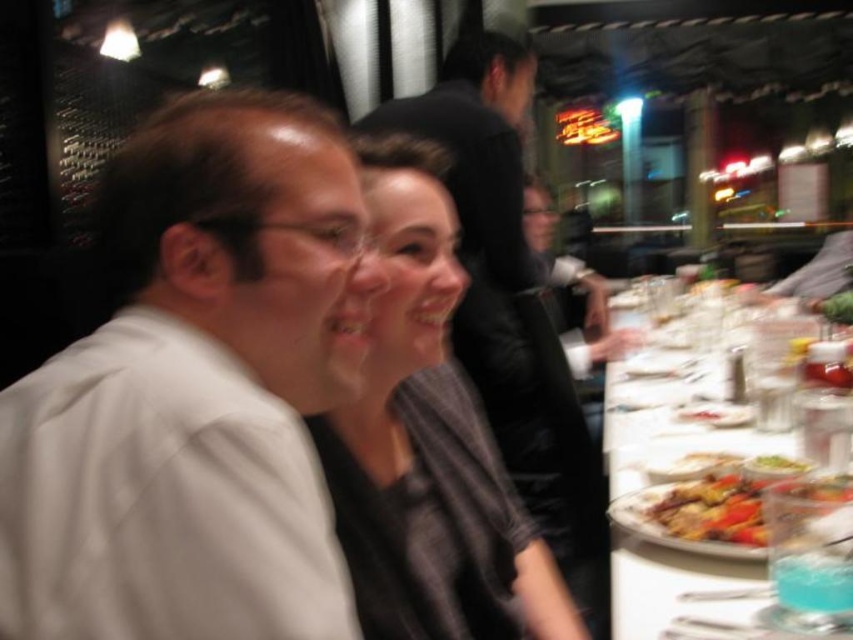
Question: Which point is farther from the camera taking this photo?

Choices:
 (A) (477, 435)
 (B) (718, 532)
 (C) (648, 506)
 (D) (726, 428)

Answer: (D)

Question: Is white glossy plate at right bigger than shiny golden plate at lower right?

Choices:
 (A) yes
 (B) no

Answer: (A)

Question: Which of the following is the farthest from the observer?

Choices:
 (A) white glossy plate at right
 (B) white matte shirt at left

Answer: (A)

Question: Does white matte shirt at left have a lesser width compared to white glossy plate at right?

Choices:
 (A) no
 (B) yes

Answer: (B)

Question: Which object is farther from the camera taking this photo?

Choices:
 (A) white glossy plate at right
 (B) golden brown crispy chicken at right

Answer: (B)

Question: Can you confirm if matte black shirt at center is positioned to the right of golden brown crispy chicken at right?

Choices:
 (A) yes
 (B) no

Answer: (B)